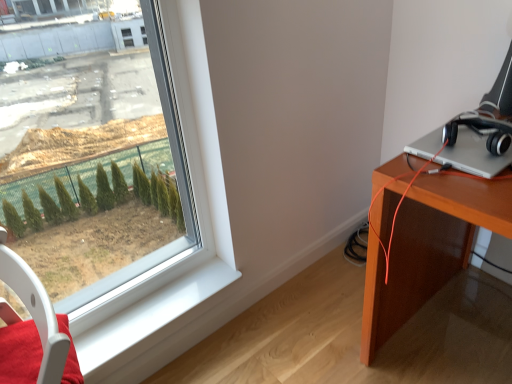
Question: Should I look upward or downward to see black matte headphones at right?

Choices:
 (A) down
 (B) up

Answer: (B)

Question: Is white glossy window sill at lower left aimed at white plastic swivel chair at lower left?

Choices:
 (A) yes
 (B) no

Answer: (B)

Question: Is white glossy window sill at lower left at the left side of white plastic swivel chair at lower left?

Choices:
 (A) no
 (B) yes

Answer: (A)

Question: From a real-world perspective, is white glossy window sill at lower left physically below white plastic swivel chair at lower left?

Choices:
 (A) no
 (B) yes

Answer: (B)

Question: From a real-world perspective, is white glossy window sill at lower left located higher than white plastic swivel chair at lower left?

Choices:
 (A) yes
 (B) no

Answer: (B)

Question: Is white glossy window sill at lower left positioned far away from white plastic swivel chair at lower left?

Choices:
 (A) no
 (B) yes

Answer: (A)

Question: From the image's perspective, would you say white glossy window sill at lower left is shown under white plastic swivel chair at lower left?

Choices:
 (A) yes
 (B) no

Answer: (A)

Question: Is white plastic swivel chair at lower left to the right of black matte headphones at right from the viewer's perspective?

Choices:
 (A) no
 (B) yes

Answer: (A)

Question: Considering the relative sizes of white plastic swivel chair at lower left and black matte headphones at right in the image provided, is white plastic swivel chair at lower left thinner than black matte headphones at right?

Choices:
 (A) yes
 (B) no

Answer: (B)

Question: Is white plastic swivel chair at lower left further to the viewer compared to black matte headphones at right?

Choices:
 (A) yes
 (B) no

Answer: (B)

Question: Is white plastic swivel chair at lower left looking in the opposite direction of black matte headphones at right?

Choices:
 (A) no
 (B) yes

Answer: (B)

Question: From the image's perspective, is white plastic swivel chair at lower left on top of black matte headphones at right?

Choices:
 (A) yes
 (B) no

Answer: (B)

Question: Is white plastic swivel chair at lower left far away from black matte headphones at right?

Choices:
 (A) no
 (B) yes

Answer: (B)

Question: Is white glossy window sill at lower left surrounded by black matte headphones at right?

Choices:
 (A) yes
 (B) no

Answer: (B)